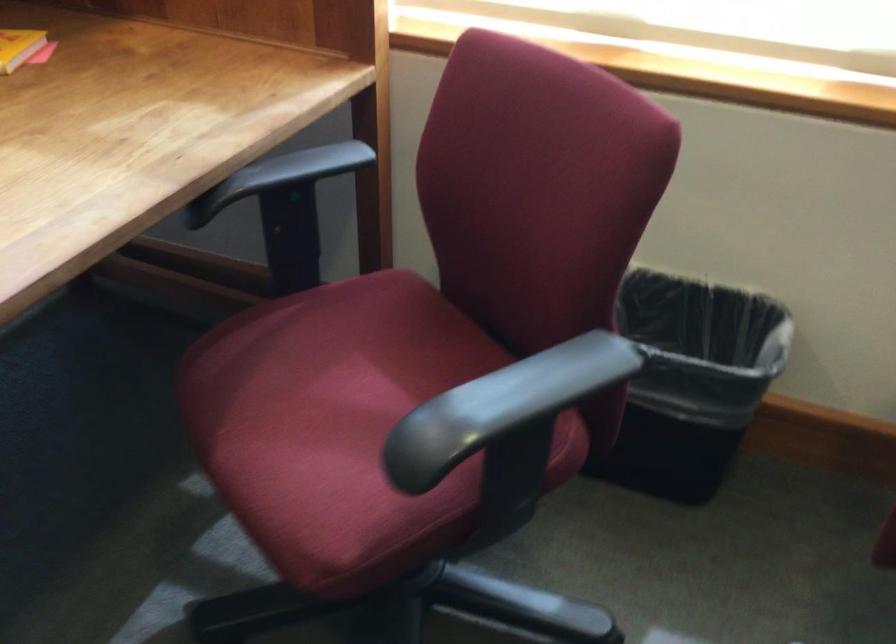
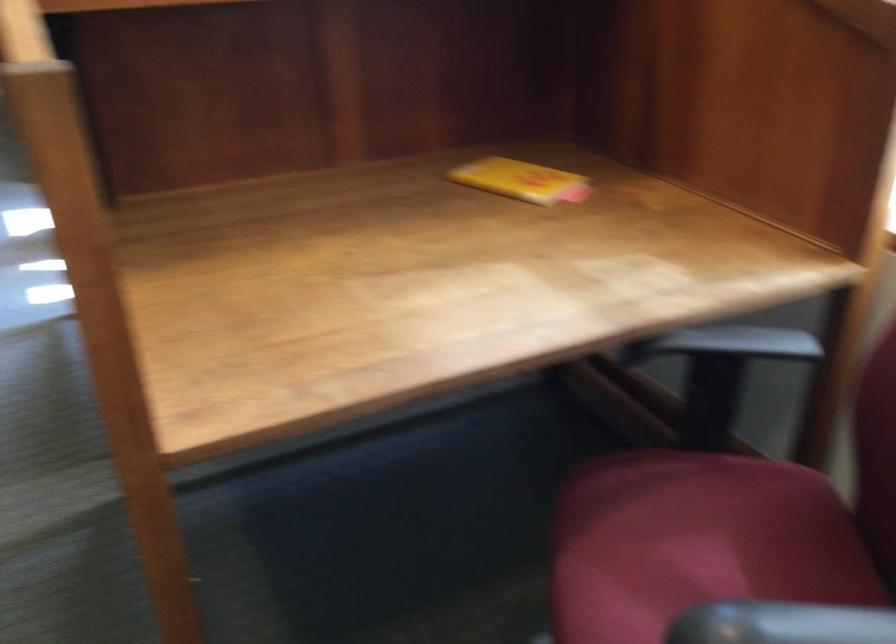
Question: I am providing you with two images of the same scene from different viewpoints. After the viewpoint changes to image2, which objects are now occluded?

Choices:
 (A) small yellow box
 (B) red chair sitting surface
 (C) black chair armrest
 (D) none of these

Answer: (D)